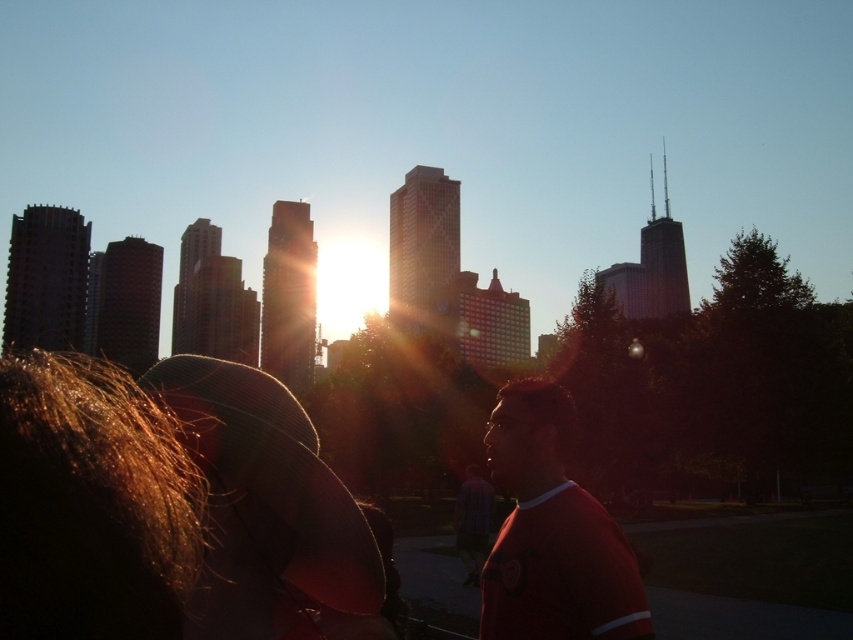
Is red matte shirt at center above blue striped shirt at center?

Yes, red matte shirt at center is above blue striped shirt at center.

Is point (537, 440) positioned in front of point (463, 525)?

Yes, point (537, 440) is in front of point (463, 525).

What do you see at coordinates (552, 532) in the screenshot?
I see `red matte shirt at center` at bounding box center [552, 532].

You are a GUI agent. You are given a task and a screenshot of the screen. Output one action in this format:
    pyautogui.click(x=<x>, y=<y>)
    Task: Click on the red matte shirt at center
    
    Given the screenshot: What is the action you would take?
    pyautogui.click(x=552, y=532)

Is shiny brown hair at lower left bigger than blue striped shirt at center?

Indeed, shiny brown hair at lower left has a larger size compared to blue striped shirt at center.

Does shiny brown hair at lower left appear on the left side of blue striped shirt at center?

Correct, you'll find shiny brown hair at lower left to the left of blue striped shirt at center.

Who is more forward, (4, 602) or (469, 502)?

Point (4, 602) is in front.

The image size is (853, 640). Identify the location of shiny brown hair at lower left. (91, 502).

Does shiny brown hair at lower left lie in front of red matte shirt at center?

Yes, it is.

Is point (149, 497) more distant than point (564, 481)?

That is False.

Who is more forward, (32, 545) or (520, 576)?

Point (32, 545) is in front.

Where is `shiny brown hair at lower left`? Image resolution: width=853 pixels, height=640 pixels. shiny brown hair at lower left is located at coordinates (91, 502).